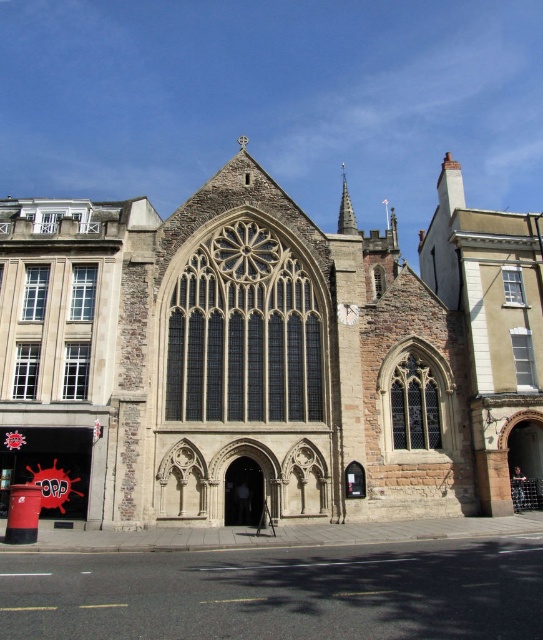
You are an architect designing a model of this building. You need to ensure the smooth stone spire at upper center and the white stone clock at center are proportionally accurate. Which object should have a wider base in your model?

The smooth stone spire at upper center should have a wider base in your model because its width is larger than the white stone clock at center according to the description.

You are standing in front of the beige stone church at center and want to take a photo of the smooth stone spire at upper center. Since the spire is behind the church, will it be visible in the photo if you frame the church in the foreground?

The beige stone church at center is closer to the viewer than the smooth stone spire at upper center, so the spire is behind the church. Therefore, if you frame the church in the foreground, the smooth stone spire at upper center will be visible in the photo as it is positioned behind the church.